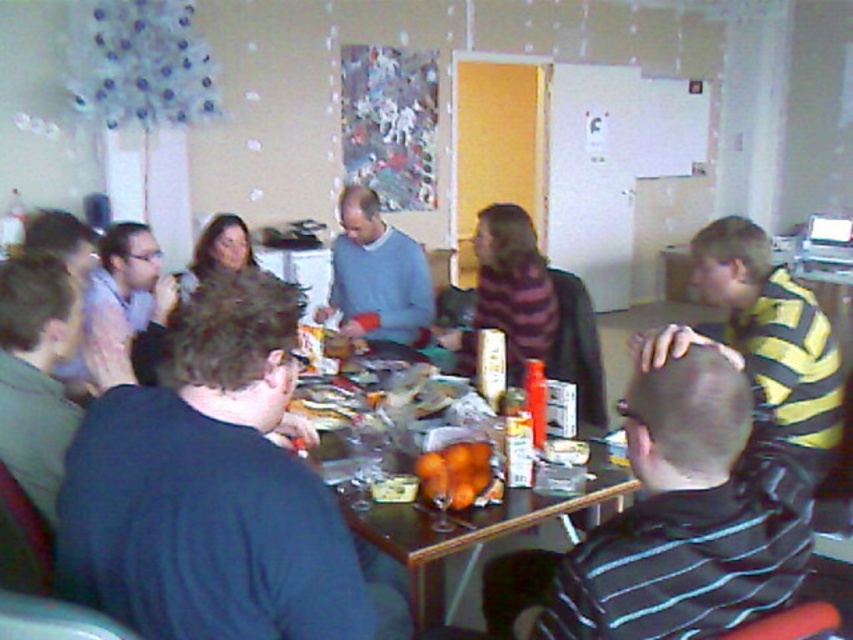
Question: Does striped shirt at right appear over striped sweater at center?

Choices:
 (A) yes
 (B) no

Answer: (B)

Question: In this image, where is wooden table at center located relative to striped sweater at center?

Choices:
 (A) right
 (B) left

Answer: (B)

Question: In this image, where is matte purple shirt at left located relative to orange matte glass at center?

Choices:
 (A) below
 (B) above

Answer: (B)

Question: Estimate the real-world distances between objects in this image. Which object is farther from the orange matte glass at center?

Choices:
 (A) yellow striped shirt at right
 (B) dark blue sweater at left
 (C) matte blue sweater at center
 (D) matte purple shirt at left

Answer: (C)

Question: Which of the following is the farthest from the observer?

Choices:
 (A) pyautogui.click(x=421, y=288)
 (B) pyautogui.click(x=418, y=460)
 (C) pyautogui.click(x=119, y=246)
 (D) pyautogui.click(x=779, y=506)

Answer: (A)

Question: Among these points, which one is farthest from the camera?

Choices:
 (A) (15, 317)
 (B) (753, 608)

Answer: (A)